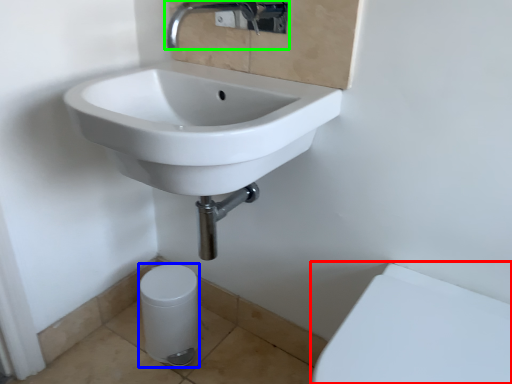
Question: Considering the real-world distances, which object is closest to porcelain (highlighted by a red box)? porcelain (highlighted by a blue box) or tap (highlighted by a green box).

Choices:
 (A) porcelain
 (B) tap

Answer: (A)